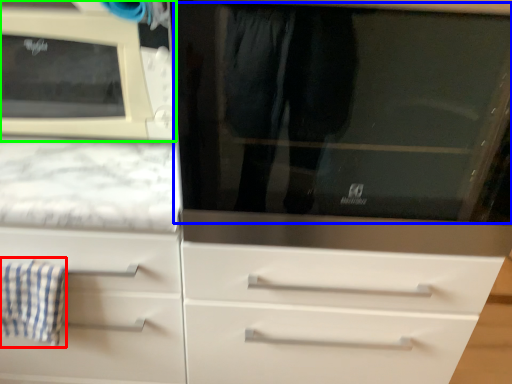
Question: Considering the real-world distances, which object is farthest from bath towel (highlighted by a red box)? glass door (highlighted by a blue box) or microwave oven (highlighted by a green box)?

Choices:
 (A) glass door
 (B) microwave oven

Answer: (A)